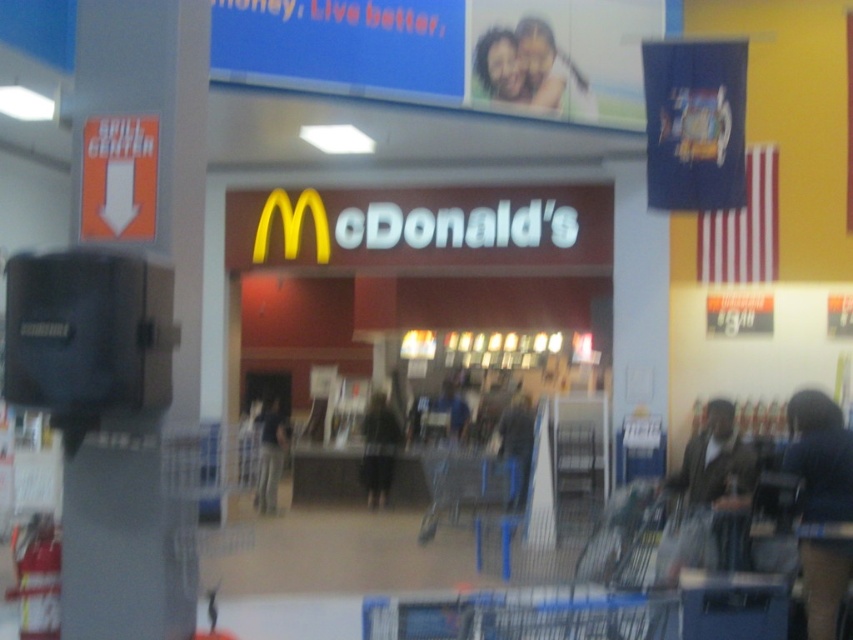
Which is below, dark brown leather jacket at lower right or blue denim jeans at center?

blue denim jeans at center is below.

Consider the image. Is dark brown leather jacket at lower right below blue denim jeans at center?

Incorrect, dark brown leather jacket at lower right is not positioned below blue denim jeans at center.

Is point (723, 500) farther from viewer compared to point (461, 420)?

No, it is not.

Locate an element on the screen. This screenshot has width=853, height=640. dark brown leather jacket at lower right is located at coordinates (x=714, y=465).

Between dark blue fabric at lower right and blue denim jeans at center, which one has less height?

blue denim jeans at center

Does dark blue fabric at lower right have a smaller size compared to blue denim jeans at center?

Correct, dark blue fabric at lower right occupies less space than blue denim jeans at center.

Does point (840, 500) come farther from viewer compared to point (450, 401)?

No.

The height and width of the screenshot is (640, 853). I want to click on dark blue fabric at lower right, so click(x=819, y=456).

Does point (804, 435) lie in front of point (517, 394)?

That is True.

Measure the distance from dark blue fabric at lower right to dark blue jeans at center.

dark blue fabric at lower right is 19.94 feet from dark blue jeans at center.

Identify the location of dark blue fabric at lower right. The width and height of the screenshot is (853, 640). (819, 456).

Locate an element on the screen. This screenshot has height=640, width=853. dark blue fabric at lower right is located at coordinates (819, 456).